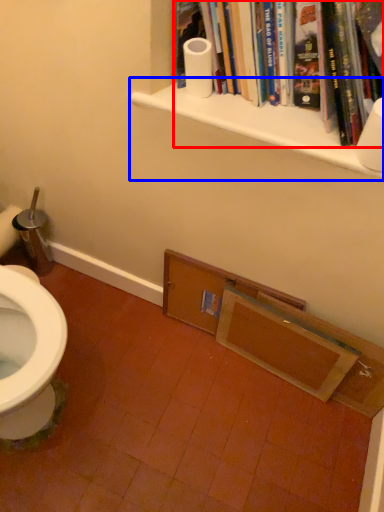
Question: Which object is further to the camera taking this photo, book (highlighted by a red box) or shelf (highlighted by a blue box)?

Choices:
 (A) book
 (B) shelf

Answer: (B)